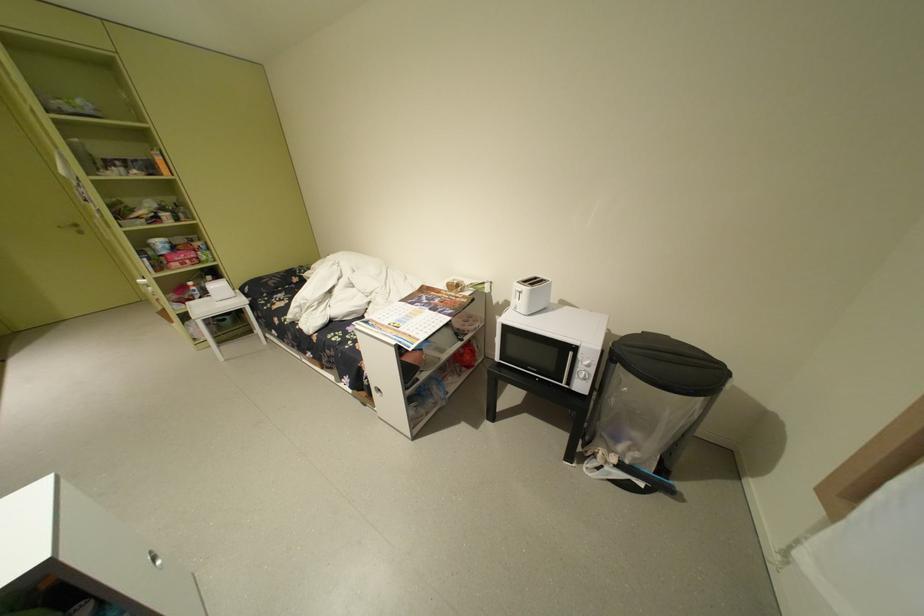
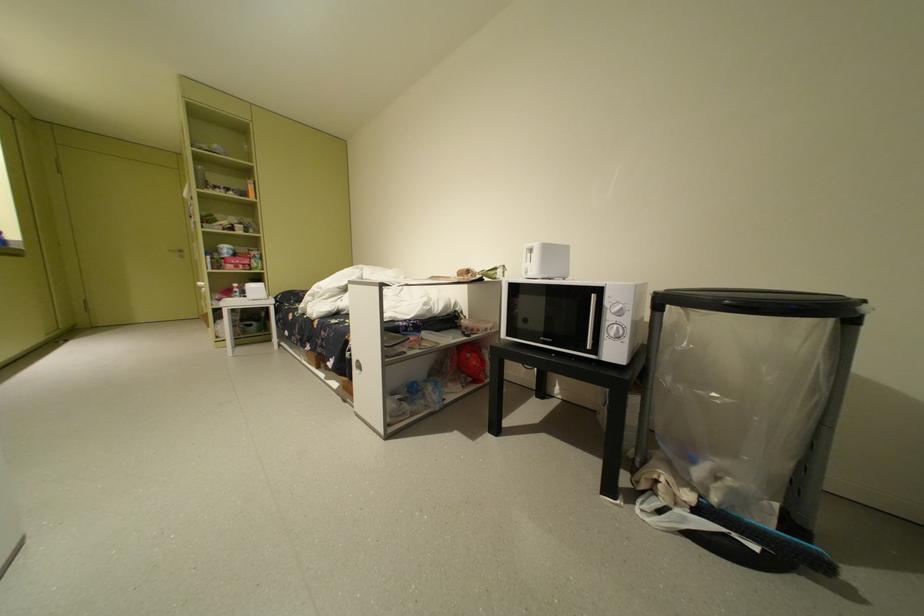
What movement of the cameraman would produce the second image?

The cameraman moved toward right, forward.